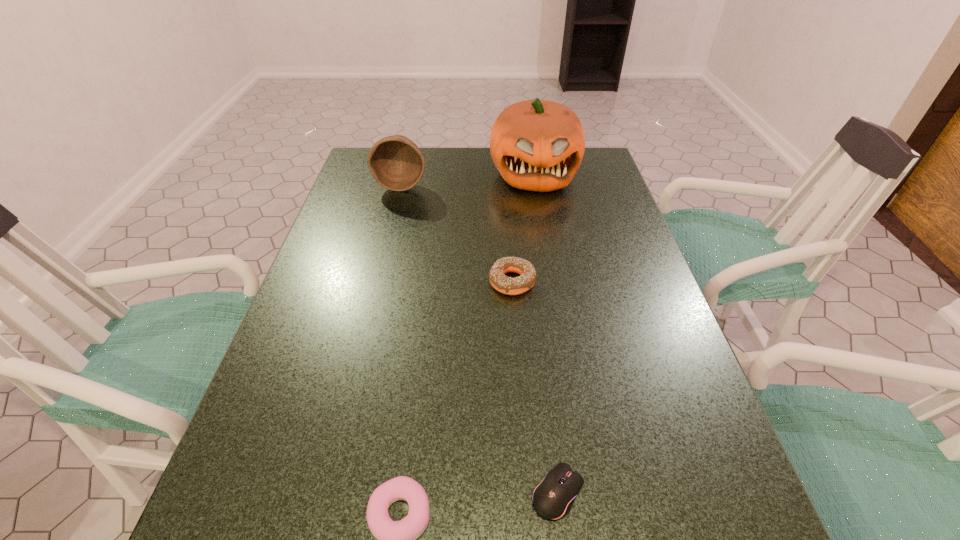
Identify the location of pumpkin. (538, 145).

I want to click on the fourth shortest object, so click(x=396, y=162).

Find the location of a particular element. This screenshot has width=960, height=540. the third farthest object is located at coordinates (510, 286).

The height and width of the screenshot is (540, 960). I want to click on computer mouse, so click(553, 498).

Find the location of a particular element. This screenshot has height=540, width=960. vacant area situated 0.400m on the face of the tallest object is located at coordinates (555, 292).

Find the location of a particular element. This screenshot has height=540, width=960. free space located on the front of the bowl is located at coordinates (383, 258).

At what (x,y) coordinates should I click in order to perform the action: click on vacant space located 0.300m on the left of the doughnut. Please return your answer as a coordinate pair (x, y). The height and width of the screenshot is (540, 960). Looking at the image, I should click on (363, 282).

You are a GUI agent. You are given a task and a screenshot of the screen. Output one action in this format:
    pyautogui.click(x=<x>, y=<y>)
    Task: Click on the free location located on the back of the computer mouse
    
    Given the screenshot: What is the action you would take?
    pyautogui.click(x=539, y=339)

Find the location of a particular element. Image resolution: width=960 pixels, height=540 pixels. pumpkin situated at the far edge is located at coordinates (538, 145).

Locate an element on the screen. This screenshot has height=540, width=960. bowl located in the far edge section of the desktop is located at coordinates (396, 162).